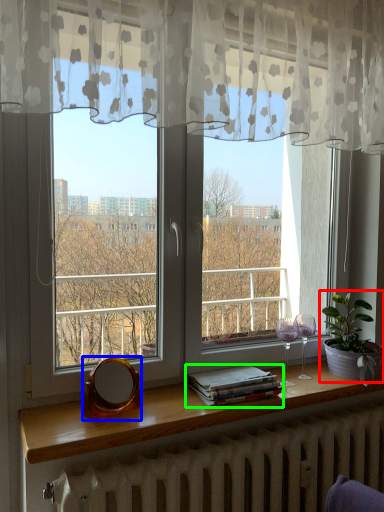
Question: Estimate the real-world distances between objects in this image. Which object is closer to houseplant (highlighted by a red box), mirror (highlighted by a blue box) or book (highlighted by a green box)?

Choices:
 (A) mirror
 (B) book

Answer: (B)